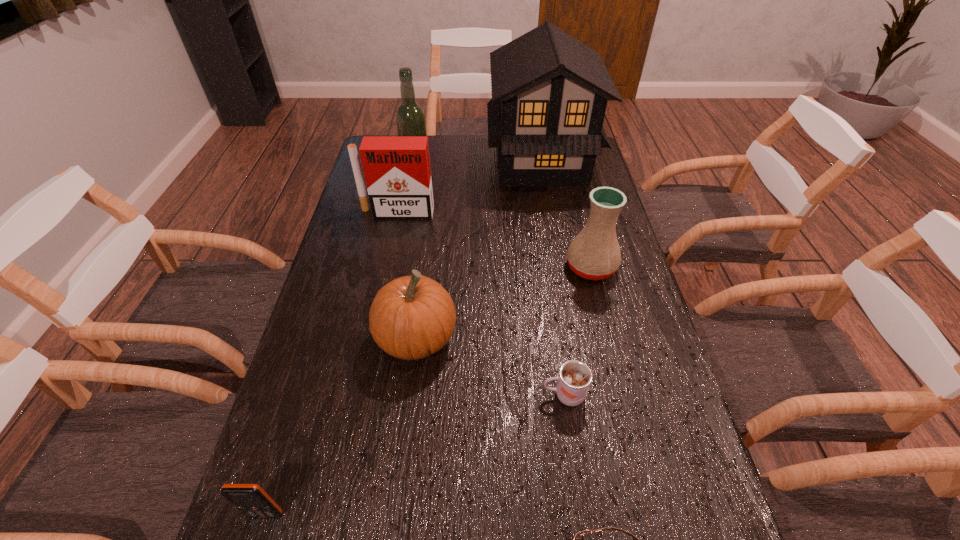
The image size is (960, 540). What are the coordinates of `object that is the seventh nearest to the pumpkin` in the screenshot? It's located at (410, 118).

The height and width of the screenshot is (540, 960). I want to click on free space that satisfies the following two spatial constraints: 1. on the side with the handle of the seventh tallest object; 2. on the screen of the sixth tallest object, so click(583, 515).

Find the location of `blank space that satisfies the following two spatial constraints: 1. on the front-facing side of the dollhouse; 2. on the screen of the cellular telephone`. blank space that satisfies the following two spatial constraints: 1. on the front-facing side of the dollhouse; 2. on the screen of the cellular telephone is located at coordinates (604, 515).